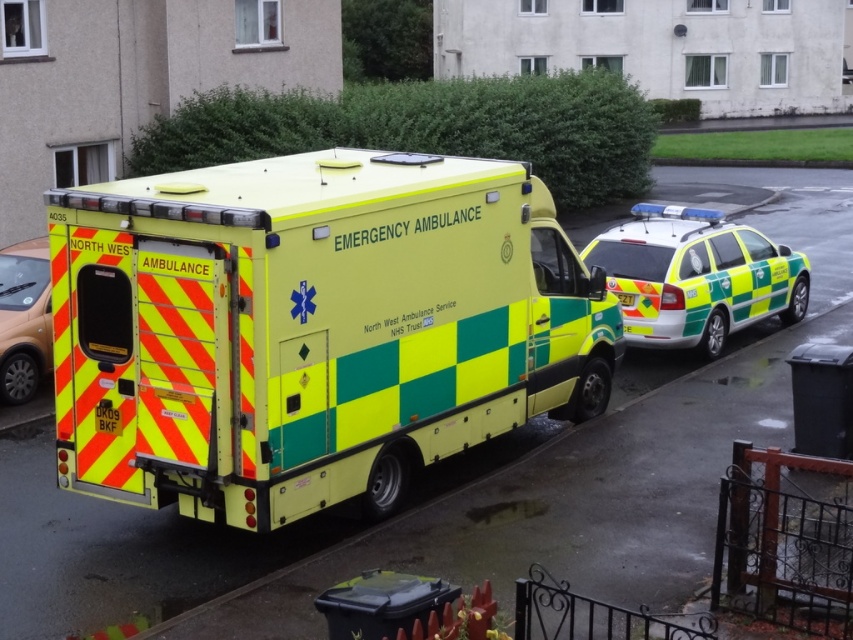
Image resolution: width=853 pixels, height=640 pixels. What do you see at coordinates (312, 328) in the screenshot?
I see `yellow/green checkered plastic ambulance at center` at bounding box center [312, 328].

Between point (367, 492) and point (1, 264), which one is positioned in front?

Positioned in front is point (367, 492).

This screenshot has width=853, height=640. I want to click on yellow/green checkered plastic ambulance at center, so click(x=312, y=328).

Can you confirm if yellow/green checkered plastic ambulance at center is thinner than green and yellow painted car at right?

No.

Between yellow/green checkered plastic ambulance at center and green and yellow painted car at right, which one is positioned higher?

Positioned higher is green and yellow painted car at right.

Who is more forward, (312, 266) or (759, 253)?

Positioned in front is point (312, 266).

Locate an element on the screen. This screenshot has height=640, width=853. yellow/green checkered plastic ambulance at center is located at coordinates (312, 328).

Based on the photo, measure the distance from green and yellow painted car at right to matte orange car at left.

They are 24.73 feet apart.

Can you confirm if green and yellow painted car at right is shorter than matte orange car at left?

No, green and yellow painted car at right is not shorter than matte orange car at left.

Where is `green and yellow painted car at right`? green and yellow painted car at right is located at coordinates 695,276.